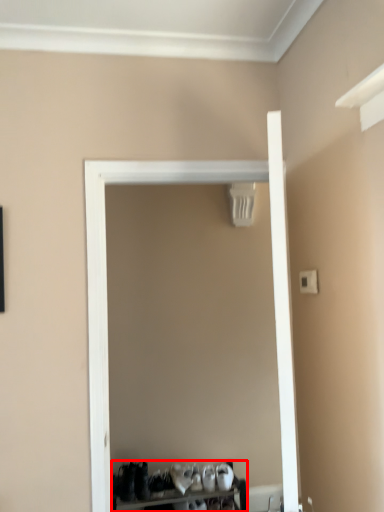
Question: From the image's perspective, what is the correct spatial positioning of furniture (annotated by the red box) in reference to door?

Choices:
 (A) below
 (B) above

Answer: (A)